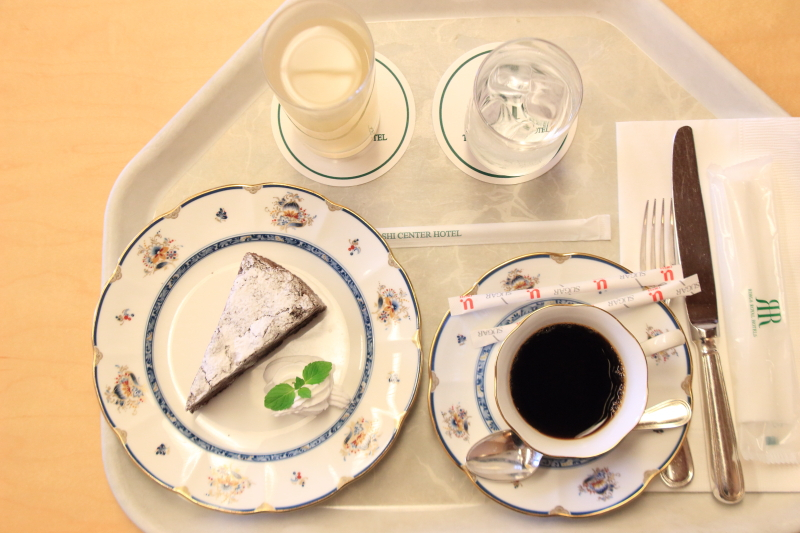
Image resolution: width=800 pixels, height=533 pixels. Find the location of `cafeteria tray`. cafeteria tray is located at coordinates (645, 61).